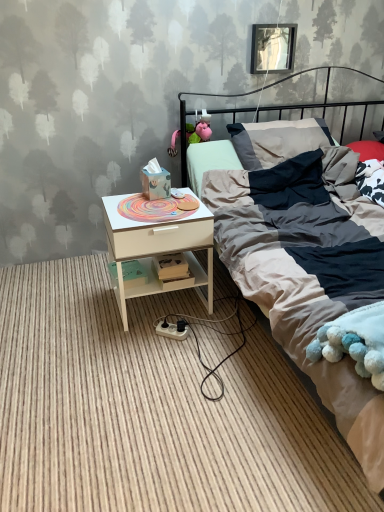
Question: Is metallic rectangular frame at upper center looking in the opposite direction of white wood nightstand at lower left?

Choices:
 (A) no
 (B) yes

Answer: (A)

Question: Considering the relative sizes of metallic rectangular frame at upper center and white wood nightstand at lower left in the image provided, is metallic rectangular frame at upper center smaller than white wood nightstand at lower left?

Choices:
 (A) yes
 (B) no

Answer: (A)

Question: Does metallic rectangular frame at upper center come in front of white wood nightstand at lower left?

Choices:
 (A) yes
 (B) no

Answer: (B)

Question: From a real-world perspective, is metallic rectangular frame at upper center beneath white wood nightstand at lower left?

Choices:
 (A) yes
 (B) no

Answer: (B)

Question: Is metallic rectangular frame at upper center bigger than white wood nightstand at lower left?

Choices:
 (A) no
 (B) yes

Answer: (A)

Question: Is white wood nightstand at lower left located within metallic rectangular frame at upper center?

Choices:
 (A) no
 (B) yes

Answer: (A)

Question: Is white wood nightstand at lower left closer to camera compared to textured cotton bed at center?

Choices:
 (A) yes
 (B) no

Answer: (B)

Question: Is white wood nightstand at lower left directly adjacent to textured cotton bed at center?

Choices:
 (A) yes
 (B) no

Answer: (B)

Question: Could textured cotton bed at center be considered to be inside white wood nightstand at lower left?

Choices:
 (A) no
 (B) yes

Answer: (A)

Question: Is white wood nightstand at lower left positioned with its back to textured cotton bed at center?

Choices:
 (A) yes
 (B) no

Answer: (A)

Question: From a real-world perspective, is white wood nightstand at lower left under textured cotton bed at center?

Choices:
 (A) yes
 (B) no

Answer: (A)

Question: From the image's perspective, is white wood nightstand at lower left over textured cotton bed at center?

Choices:
 (A) yes
 (B) no

Answer: (B)

Question: Is textured cotton bed at center at the right side of metallic rectangular frame at upper center?

Choices:
 (A) no
 (B) yes

Answer: (B)